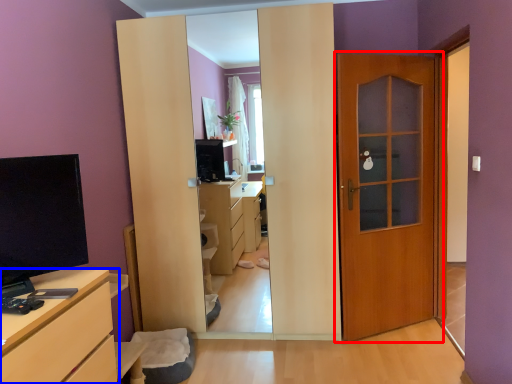
Question: Which object appears farthest to the camera in this image, door (highlighted by a red box) or chest of drawers (highlighted by a blue box)?

Choices:
 (A) door
 (B) chest of drawers

Answer: (A)